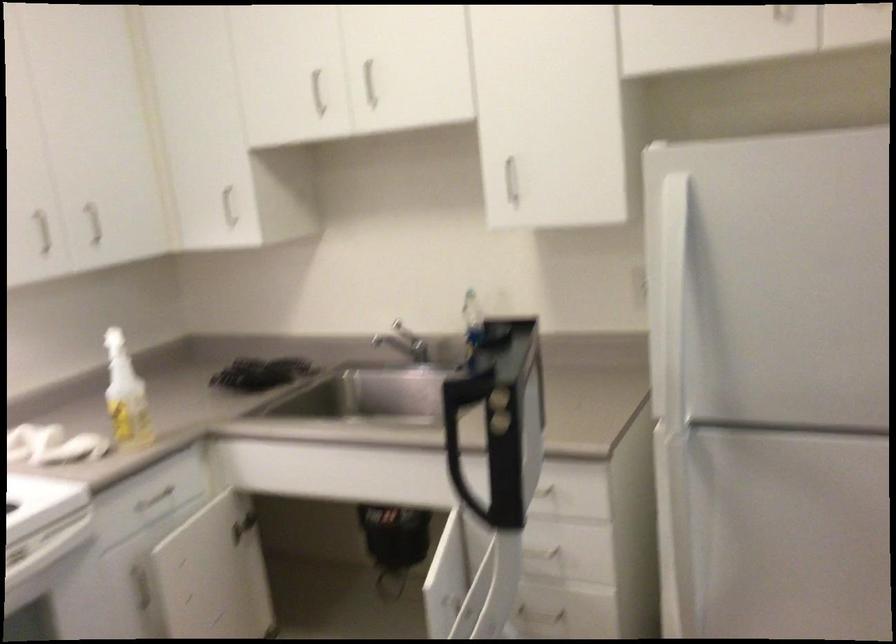
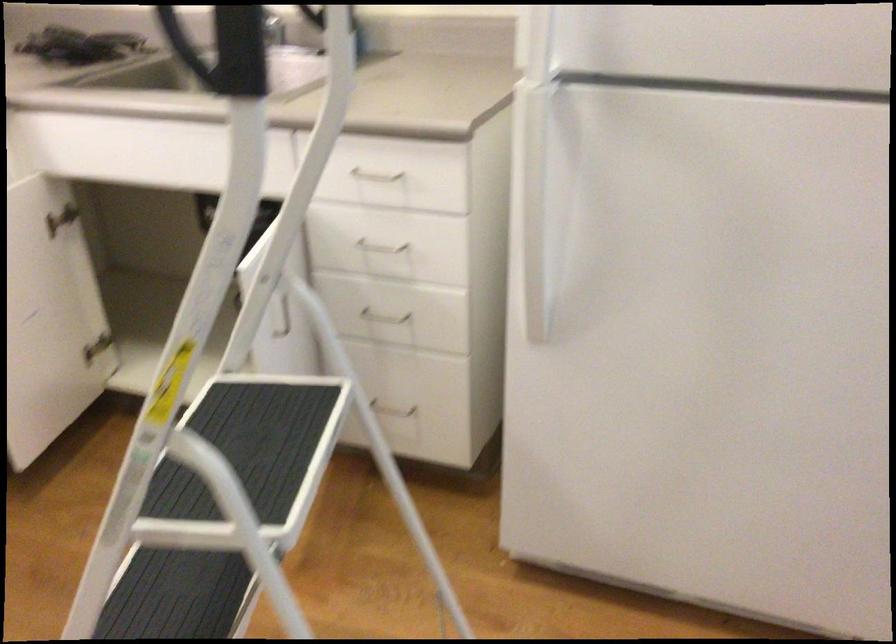
Locate, in the second image, the point that corresponds to the point at 530,545 in the first image.

(380, 247)